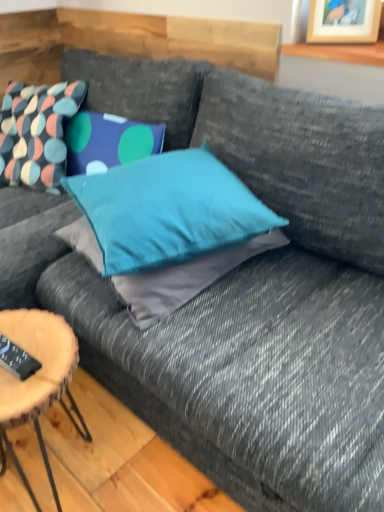
This screenshot has width=384, height=512. I want to click on teal fabric pillow at center, marked as the 2th pillow in a left-to-right arrangement, so click(x=168, y=210).

What do you see at coordinates (168, 210) in the screenshot? I see `teal fabric pillow at center, marked as the 2th pillow in a left-to-right arrangement` at bounding box center [168, 210].

Measure the distance between point (x=326, y=17) and camera.

The depth of point (x=326, y=17) is 1.30 meters.

Identify the location of teal fabric pillow at center, arranged as the first pillow when viewed from the front. The image size is (384, 512). (168, 210).

How different are the orientations of wooden log coffee table at lower left and wooden picture frame at upper right in degrees?

68.2 degrees separate the facing orientations of wooden log coffee table at lower left and wooden picture frame at upper right.

From the image's perspective, between wooden log coffee table at lower left and wooden picture frame at upper right, which one is located above?

wooden picture frame at upper right appears higher in the image.

Between point (3, 368) and point (328, 18), which one is positioned behind?

The point (328, 18) is behind.

Is there a large distance between wooden log coffee table at lower left and multicolored fabric pillow at upper left, which appears as the first pillow when viewed from the left?

wooden log coffee table at lower left is actually quite close to multicolored fabric pillow at upper left, which appears as the first pillow when viewed from the left.

Considering the sizes of objects wooden log coffee table at lower left and multicolored fabric pillow at upper left, which appears as the first pillow when viewed from the left, in the image provided, who is taller, wooden log coffee table at lower left or multicolored fabric pillow at upper left, which appears as the first pillow when viewed from the left,?

With more height is wooden log coffee table at lower left.

Is wooden log coffee table at lower left further to camera compared to multicolored fabric pillow at upper left, the 2th pillow viewed from the front?

No, wooden log coffee table at lower left is closer to the camera.

Do you think wooden picture frame at upper right is within black plastic remote control at lower left, or outside of it?

wooden picture frame at upper right lies outside black plastic remote control at lower left.

Is point (330, 41) closer to camera compared to point (12, 346)?

No, (330, 41) is further to viewer.

Based on the photo, does wooden picture frame at upper right touch black plastic remote control at lower left?

No, wooden picture frame at upper right is not next to black plastic remote control at lower left.

What's the angular difference between wooden picture frame at upper right and black plastic remote control at lower left's facing directions?

They differ by 22 degrees in their facing directions.

Is wooden picture frame at upper right positioned in front of multicolored fabric pillow at upper left, positioned as the first pillow in back-to-front order?

Yes, it is in front of multicolored fabric pillow at upper left, positioned as the first pillow in back-to-front order.

Are wooden picture frame at upper right and multicolored fabric pillow at upper left, positioned as the first pillow in back-to-front order, far apart?

Indeed, wooden picture frame at upper right is not near multicolored fabric pillow at upper left, positioned as the first pillow in back-to-front order.

Which is more to the right, wooden picture frame at upper right or multicolored fabric pillow at upper left, positioned as the first pillow in back-to-front order?

From the viewer's perspective, wooden picture frame at upper right appears more on the right side.

How far apart are wooden picture frame at upper right and multicolored fabric pillow at upper left, which appears as the first pillow when viewed from the left?

The distance of wooden picture frame at upper right from multicolored fabric pillow at upper left, which appears as the first pillow when viewed from the left, is 1.03 meters.

From a real-world perspective, is multicolored fabric pillow at upper left, the 2th pillow viewed from the front, beneath wooden picture frame at upper right?

Indeed, from a real-world perspective, multicolored fabric pillow at upper left, the 2th pillow viewed from the front, is positioned beneath wooden picture frame at upper right.

Which point is more distant from viewer, (x=56, y=188) or (x=327, y=14)?

The point (x=56, y=188) is farther.

Would you say multicolored fabric pillow at upper left, the 2th pillow viewed from the front, contains wooden picture frame at upper right?

No, wooden picture frame at upper right is not surrounded by multicolored fabric pillow at upper left, the 2th pillow viewed from the front.

Is multicolored fabric pillow at upper left, which appears as the first pillow when viewed from the left, oriented towards wooden picture frame at upper right?

No, multicolored fabric pillow at upper left, which appears as the first pillow when viewed from the left, is not oriented towards wooden picture frame at upper right.

Would you say wooden log coffee table at lower left is inside or outside black plastic remote control at lower left?

wooden log coffee table at lower left exists outside the volume of black plastic remote control at lower left.

Which point is more forward, [16,382] or [24,364]?

The point [16,382] is closer.

From a real-world perspective, who is located higher, wooden log coffee table at lower left or black plastic remote control at lower left?

black plastic remote control at lower left is physically above.

Measure the distance between wooden log coffee table at lower left and black plastic remote control at lower left.

wooden log coffee table at lower left is 4.72 inches away from black plastic remote control at lower left.

Does teal fabric pillow at center, marked as the 2th pillow in a left-to-right arrangement, have a lesser height compared to multicolored fabric pillow at upper left, which appears as the first pillow when viewed from the left?

Correct, teal fabric pillow at center, marked as the 2th pillow in a left-to-right arrangement, is not as tall as multicolored fabric pillow at upper left, which appears as the first pillow when viewed from the left.

Considering the relative sizes of teal fabric pillow at center, acting as the 2th pillow starting from the back, and multicolored fabric pillow at upper left, which appears as the first pillow when viewed from the left, in the image provided, is teal fabric pillow at center, acting as the 2th pillow starting from the back, bigger than multicolored fabric pillow at upper left, which appears as the first pillow when viewed from the left,?

Incorrect, teal fabric pillow at center, acting as the 2th pillow starting from the back, is not larger than multicolored fabric pillow at upper left, which appears as the first pillow when viewed from the left.

From a real-world perspective, is teal fabric pillow at center, arranged as the first pillow when viewed from the front, under multicolored fabric pillow at upper left, which appears as the first pillow when viewed from the left?

Incorrect, from a real-world perspective, teal fabric pillow at center, arranged as the first pillow when viewed from the front, is higher than multicolored fabric pillow at upper left, which appears as the first pillow when viewed from the left.

In the scene shown: Is multicolored fabric pillow at upper left, which appears as the first pillow when viewed from the left, inside teal fabric pillow at center, marked as the 2th pillow in a left-to-right arrangement?

No.

You are a GUI agent. You are given a task and a screenshot of the screen. Output one action in this format:
    pyautogui.click(x=<x>, y=<y>)
    Task: Click on the coffee table in front of the wooden picture frame at upper right
    The height and width of the screenshot is (512, 384).
    Given the screenshot: What is the action you would take?
    pyautogui.click(x=35, y=377)

Find the location of a particular element. The image size is (384, 512). coffee table below the multicolored fabric pillow at upper left, which appears as the first pillow when viewed from the left (from a real-world perspective) is located at coordinates (35, 377).

Looking at this image, when comparing their distances from wooden log coffee table at lower left, does wooden picture frame at upper right or teal fabric pillow at center, marked as the 2th pillow in a left-to-right arrangement, seem closer?

teal fabric pillow at center, marked as the 2th pillow in a left-to-right arrangement, is closer to wooden log coffee table at lower left.

Estimate the real-world distances between objects in this image. Which object is further from wooden log coffee table at lower left, multicolored fabric pillow at upper left, positioned as the first pillow in back-to-front order, or black plastic remote control at lower left?

Based on the image, multicolored fabric pillow at upper left, positioned as the first pillow in back-to-front order, appears to be further to wooden log coffee table at lower left.

From the image, which object appears to be nearer to black plastic remote control at lower left, wooden log coffee table at lower left or multicolored fabric pillow at upper left, placed as the second pillow when sorted from right to left?

Based on the image, wooden log coffee table at lower left appears to be nearer to black plastic remote control at lower left.

Based on their spatial positions, is multicolored fabric pillow at upper left, the 2th pillow viewed from the front, or wooden picture frame at upper right closer to teal fabric pillow at center, which ranks as the first pillow in right-to-left order?

Among the two, multicolored fabric pillow at upper left, the 2th pillow viewed from the front, is located nearer to teal fabric pillow at center, which ranks as the first pillow in right-to-left order.

Which object lies nearer to the anchor point teal fabric pillow at center, which ranks as the first pillow in right-to-left order, wooden picture frame at upper right or multicolored fabric pillow at upper left, the 2th pillow viewed from the front?

Among the two, multicolored fabric pillow at upper left, the 2th pillow viewed from the front, is located nearer to teal fabric pillow at center, which ranks as the first pillow in right-to-left order.

Based on their spatial positions, is black plastic remote control at lower left or teal fabric pillow at center, marked as the 2th pillow in a left-to-right arrangement, further from wooden log coffee table at lower left?

Among the two, teal fabric pillow at center, marked as the 2th pillow in a left-to-right arrangement, is located further to wooden log coffee table at lower left.

From the image, which object appears to be farther from black plastic remote control at lower left, multicolored fabric pillow at upper left, placed as the second pillow when sorted from right to left, or teal fabric pillow at center, acting as the 2th pillow starting from the back?

Among the two, multicolored fabric pillow at upper left, placed as the second pillow when sorted from right to left, is located further to black plastic remote control at lower left.

When comparing their distances from wooden picture frame at upper right, does wooden log coffee table at lower left or black plastic remote control at lower left seem further?

black plastic remote control at lower left.

Locate an element on the screen. pillow located between multicolored fabric pillow at upper left, the 2th pillow viewed from the front, and wooden picture frame at upper right in the left-right direction is located at coordinates (168, 210).

You are a GUI agent. You are given a task and a screenshot of the screen. Output one action in this format:
    pyautogui.click(x=<x>, y=<y>)
    Task: Click on the pillow that lies between multicolored fabric pillow at upper left, placed as the second pillow when sorted from right to left, and wooden log coffee table at lower left from top to bottom
    
    Given the screenshot: What is the action you would take?
    pyautogui.click(x=168, y=210)

This screenshot has width=384, height=512. In order to click on remote control between teal fabric pillow at center, marked as the 2th pillow in a left-to-right arrangement, and wooden log coffee table at lower left, in the vertical direction in this screenshot , I will do `click(17, 359)`.

Where is `pillow between multicolored fabric pillow at upper left, positioned as the first pillow in back-to-front order, and black plastic remote control at lower left vertically`? The height and width of the screenshot is (512, 384). pillow between multicolored fabric pillow at upper left, positioned as the first pillow in back-to-front order, and black plastic remote control at lower left vertically is located at coordinates (168, 210).